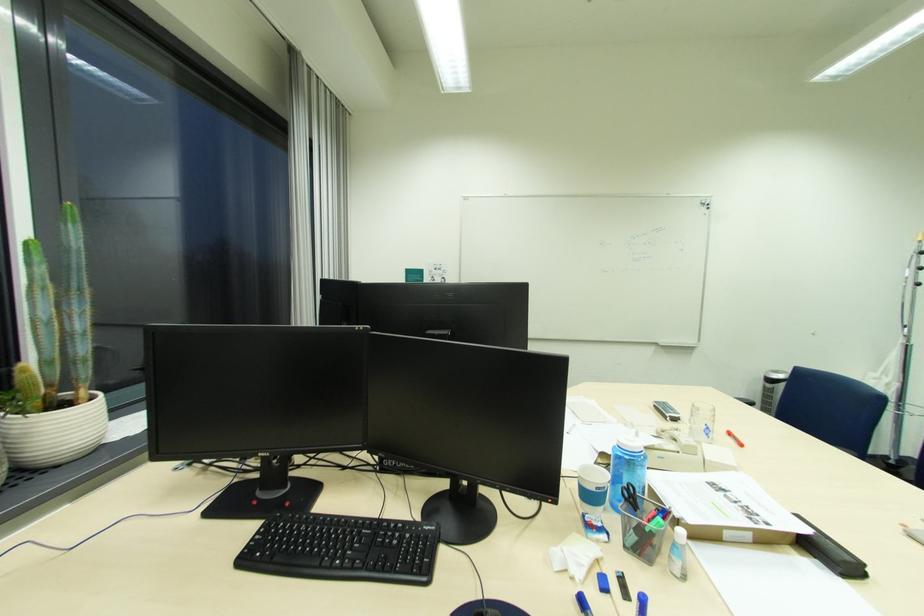
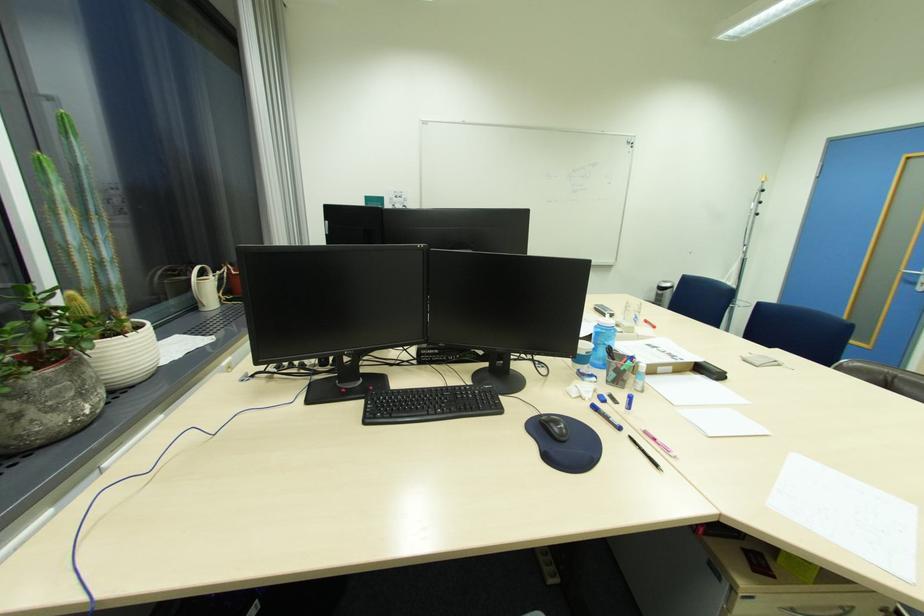
The images are taken continuously from a first-person perspective. In which direction are you moving?

The cameraman walked toward left, backward.